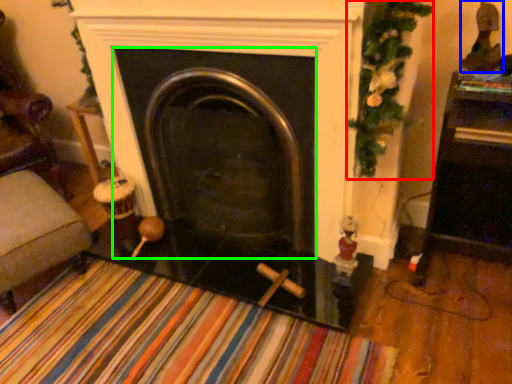
Question: Considering the real-world distances, which object is closest to christmas decoration (highlighted by a red box)? toy (highlighted by a blue box) or fireplace (highlighted by a green box).

Choices:
 (A) toy
 (B) fireplace

Answer: (A)